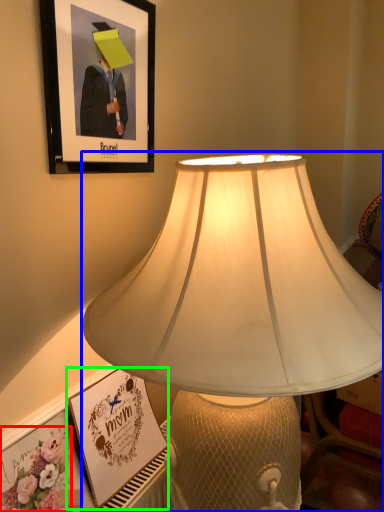
Question: Estimate the real-world distances between objects in this image. Which object is farther from flower (highlighted by a red box), lamp (highlighted by a blue box) or picture frame (highlighted by a green box)?

Choices:
 (A) lamp
 (B) picture frame

Answer: (A)